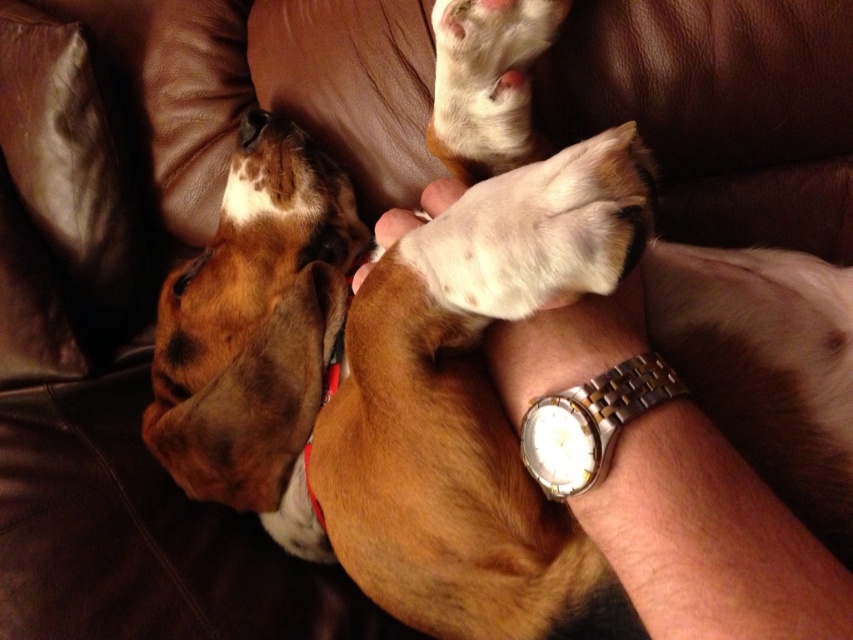
Question: Is white fur paw at center closer to the viewer compared to brown fur nose at upper center?

Choices:
 (A) yes
 (B) no

Answer: (A)

Question: Which of the following is the closest to the observer?

Choices:
 (A) red fabric neckband at center
 (B) brown fur nose at upper center
 (C) white leather hand at center
 (D) white fur paw at center

Answer: (D)

Question: Which of the following is the farthest from the observer?

Choices:
 (A) gold/steel watch at center
 (B) red fabric neckband at center
 (C) brown fur nose at upper center

Answer: (C)

Question: Where is white leather hand at center located in relation to red fabric neckband at center in the image?

Choices:
 (A) below
 (B) above

Answer: (B)

Question: Can you confirm if white fur paw at center is wider than red fabric neckband at center?

Choices:
 (A) no
 (B) yes

Answer: (B)

Question: Considering the real-world distances, which object is closest to the white fur paw at center?

Choices:
 (A) brown fur nose at upper center
 (B) red fabric neckband at center

Answer: (B)